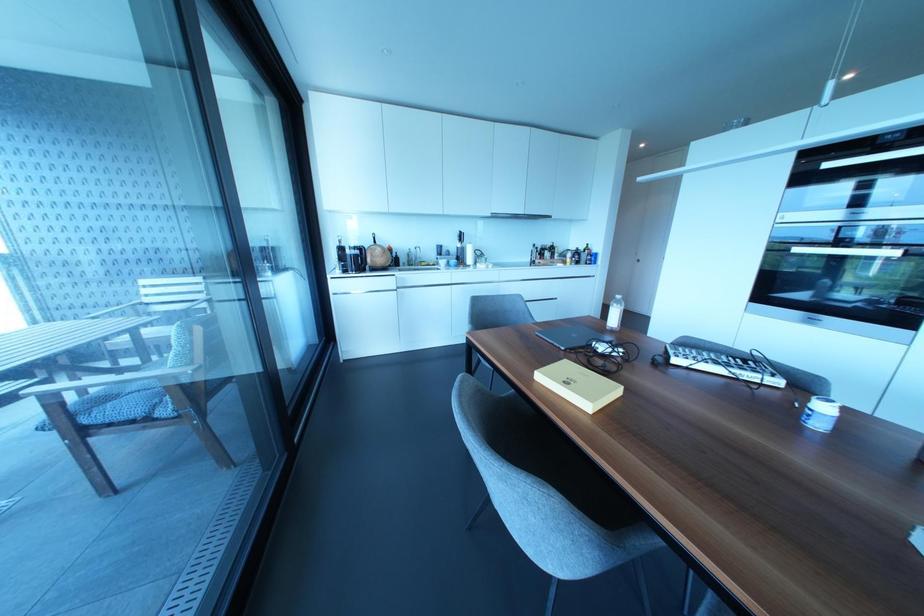
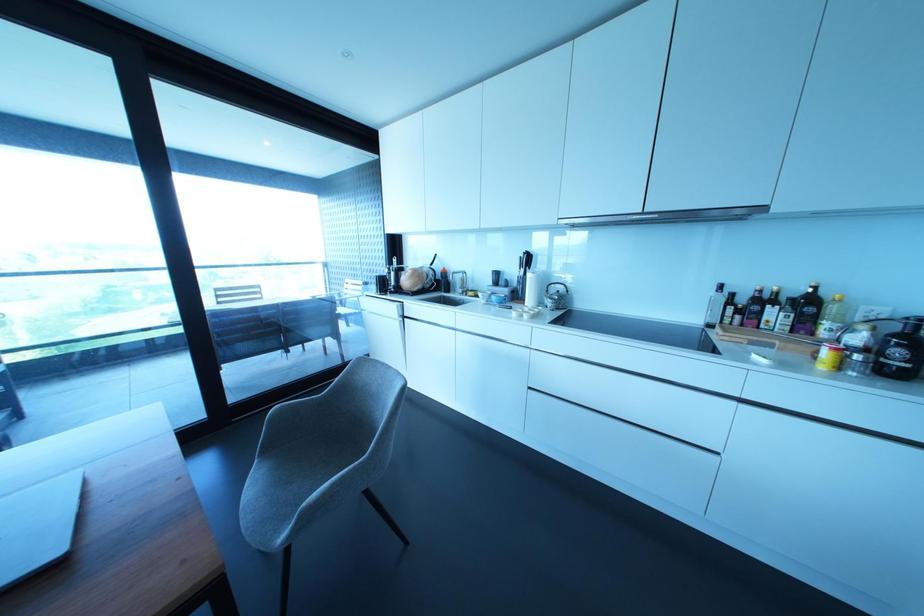
The point at [555,254] is marked in the first image. Where is the corresponding point in the second image?

(825, 323)